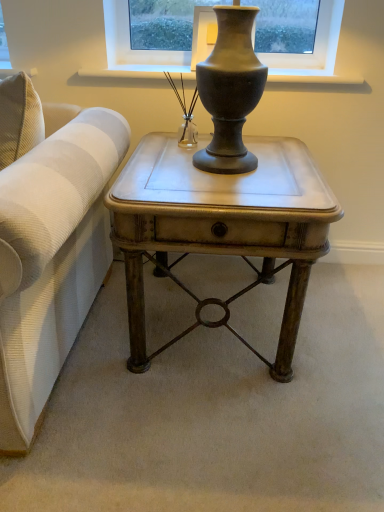
Question: Is matte metallic side table at center to the left or to the right of clear glass vase at center in the image?

Choices:
 (A) right
 (B) left

Answer: (A)

Question: Is matte metallic side table at center taller or shorter than clear glass vase at center?

Choices:
 (A) short
 (B) tall

Answer: (B)

Question: Which of these objects is positioned closest to the matte metallic side table at center?

Choices:
 (A) clear glass vase at center
 (B) matte gray vase at upper center

Answer: (A)

Question: Estimate the real-world distances between objects in this image. Which object is farther from the matte metallic side table at center?

Choices:
 (A) clear glass vase at center
 (B) matte gray vase at upper center

Answer: (B)